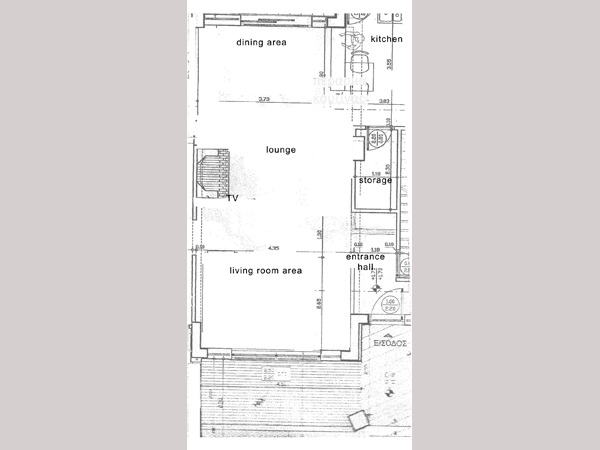
Where is `hall`? The height and width of the screenshot is (450, 600). hall is located at coordinates (364, 267).